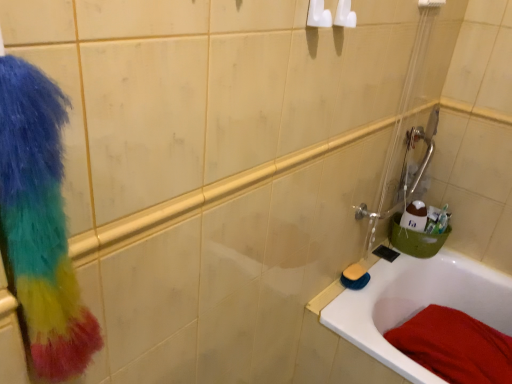
Question: Is white glossy bathtub at lower right outside of multicolored fluffy scrub at left?

Choices:
 (A) yes
 (B) no

Answer: (A)

Question: Would you say white glossy bathtub at lower right is a long distance from multicolored fluffy scrub at left?

Choices:
 (A) no
 (B) yes

Answer: (B)

Question: Would you say white glossy bathtub at lower right contains multicolored fluffy scrub at left?

Choices:
 (A) yes
 (B) no

Answer: (B)

Question: Is white glossy bathtub at lower right bigger than multicolored fluffy scrub at left?

Choices:
 (A) yes
 (B) no

Answer: (A)

Question: From a real-world perspective, is white glossy bathtub at lower right positioned under multicolored fluffy scrub at left based on gravity?

Choices:
 (A) yes
 (B) no

Answer: (A)

Question: Does white glossy bathtub at lower right appear on the left side of multicolored fluffy scrub at left?

Choices:
 (A) yes
 (B) no

Answer: (B)

Question: Is red cotton towel at lower right positioned beyond the bounds of white glossy bathtub at lower right?

Choices:
 (A) yes
 (B) no

Answer: (B)

Question: Could you tell me if red cotton towel at lower right is turned towards white glossy bathtub at lower right?

Choices:
 (A) yes
 (B) no

Answer: (A)

Question: From the image's perspective, is red cotton towel at lower right located above white glossy bathtub at lower right?

Choices:
 (A) yes
 (B) no

Answer: (A)

Question: Is red cotton towel at lower right bigger than white glossy bathtub at lower right?

Choices:
 (A) yes
 (B) no

Answer: (B)

Question: From a real-world perspective, is red cotton towel at lower right physically above white glossy bathtub at lower right?

Choices:
 (A) no
 (B) yes

Answer: (B)

Question: From the image's perspective, would you say red cotton towel at lower right is shown under white glossy bathtub at lower right?

Choices:
 (A) yes
 (B) no

Answer: (B)

Question: From a real-world perspective, does yellow sponge at lower right sit lower than red cotton towel at lower right?

Choices:
 (A) yes
 (B) no

Answer: (B)